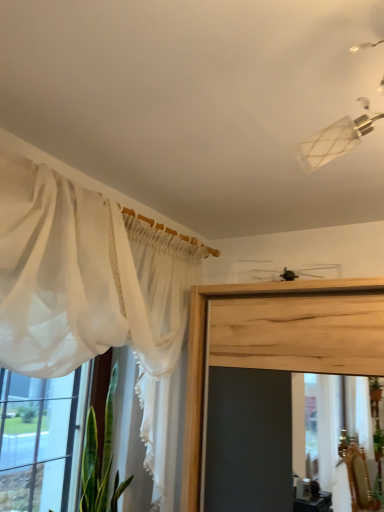
What do you see at coordinates (43, 441) in the screenshot?
I see `sheer white curtain at left` at bounding box center [43, 441].

At what (x,y) coordinates should I click in order to perform the action: click on sheer white curtain at left. Please return your answer as a coordinate pair (x, y). The image size is (384, 512). Looking at the image, I should click on (43, 441).

In order to face sheer white curtain at left, should I rotate leftwards or rightwards?

Turn left by 16.797 degrees to look at sheer white curtain at left.

What is the approximate height of sheer white curtain at left?

It is 90.14 centimeters.

Identify the location of sheer white curtain at left. (90, 288).

What do you see at coordinates (90, 288) in the screenshot? I see `sheer white curtain at left` at bounding box center [90, 288].

Find the location of a particular element. The height and width of the screenshot is (512, 384). sheer white curtain at left is located at coordinates (43, 441).

Consider the image. Which is more to the right, sheer white curtain at left or sheer white curtain at left?

sheer white curtain at left.

Looking at this image, relative to sheer white curtain at left, is sheer white curtain at left in front or behind?

sheer white curtain at left is behind sheer white curtain at left.

Between point (36, 500) and point (178, 336), which one is positioned behind?

The point (178, 336) is farther.

From the image's perspective, is sheer white curtain at left below sheer white curtain at left?

Correct, sheer white curtain at left appears lower than sheer white curtain at left in the image.

From a real-world perspective, is sheer white curtain at left physically above sheer white curtain at left?

Incorrect, from a real-world perspective, sheer white curtain at left is lower than sheer white curtain at left.

Is sheer white curtain at left wider or thinner than sheer white curtain at left?

Clearly, sheer white curtain at left has less width compared to sheer white curtain at left.

Which of these two, sheer white curtain at left or sheer white curtain at left, stands taller?

sheer white curtain at left is taller.

Considering the relative sizes of sheer white curtain at left and sheer white curtain at left in the image provided, is sheer white curtain at left smaller than sheer white curtain at left?

Yes, sheer white curtain at left is smaller than sheer white curtain at left.

Is sheer white curtain at left inside the boundaries of sheer white curtain at left, or outside?

sheer white curtain at left is not enclosed by sheer white curtain at left.

Would you say sheer white curtain at left is a long distance from sheer white curtain at left?

No, sheer white curtain at left is not far from sheer white curtain at left.

Is sheer white curtain at left turned away from sheer white curtain at left?

Yes, sheer white curtain at left's orientation is away from sheer white curtain at left.

How different are the orientations of sheer white curtain at left and sheer white curtain at left in degrees?

0.318 degrees.

Image resolution: width=384 pixels, height=512 pixels. Identify the location of window below the sheer white curtain at left (from the image's perspective). (43, 441).

Is sheer white curtain at left at the right side of sheer white curtain at left?

Correct, you'll find sheer white curtain at left to the right of sheer white curtain at left.

Considering the positions of objects sheer white curtain at left and sheer white curtain at left in the image provided, who is in front, sheer white curtain at left or sheer white curtain at left?

sheer white curtain at left is closer to the camera.

Which is closer, (43, 230) or (27, 502)?

The point (43, 230) is more forward.

From the image's perspective, between sheer white curtain at left and sheer white curtain at left, who is located below?

From the image's view, sheer white curtain at left is below.

From a real-world perspective, is sheer white curtain at left under sheer white curtain at left?

No, from a real-world perspective, sheer white curtain at left is not beneath sheer white curtain at left.

Can you confirm if sheer white curtain at left is thinner than sheer white curtain at left?

Incorrect, the width of sheer white curtain at left is not less than that of sheer white curtain at left.

Is sheer white curtain at left taller or shorter than sheer white curtain at left?

In the image, sheer white curtain at left appears to be taller than sheer white curtain at left.

Is sheer white curtain at left bigger than sheer white curtain at left?

Yes, sheer white curtain at left is bigger than sheer white curtain at left.

Is sheer white curtain at left a part of sheer white curtain at left?

That's incorrect, sheer white curtain at left is not inside sheer white curtain at left.

Are sheer white curtain at left and sheer white curtain at left located far from each other?

No, sheer white curtain at left is in close proximity to sheer white curtain at left.

Is sheer white curtain at left facing towards sheer white curtain at left?

Yes, sheer white curtain at left faces towards sheer white curtain at left.

How different are the orientations of sheer white curtain at left and sheer white curtain at left in degrees?

The angular difference between sheer white curtain at left and sheer white curtain at left is 0.318 degrees.

The height and width of the screenshot is (512, 384). I want to click on curtain above the sheer white curtain at left (from the image's perspective), so click(x=90, y=288).

This screenshot has height=512, width=384. In the image, there is a sheer white curtain at left. Identify the location of window below it (from a real-world perspective). (43, 441).

The height and width of the screenshot is (512, 384). Find the location of `curtain in front of the sheer white curtain at left`. curtain in front of the sheer white curtain at left is located at coordinates (90, 288).